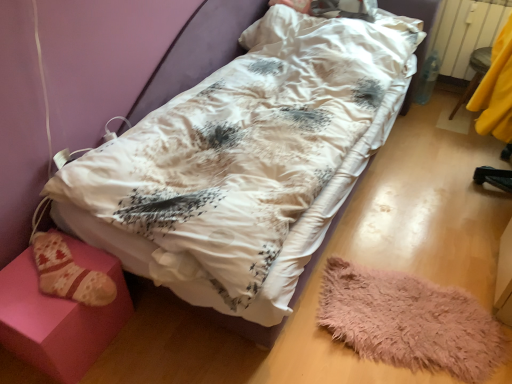
The height and width of the screenshot is (384, 512). Identify the location of white satin hospital bed at center. (250, 159).

The height and width of the screenshot is (384, 512). What do you see at coordinates (250, 159) in the screenshot?
I see `white satin hospital bed at center` at bounding box center [250, 159].

Image resolution: width=512 pixels, height=384 pixels. What do you see at coordinates (475, 74) in the screenshot?
I see `yellow fabric at right, placed as the 2th furniture when sorted from left to right` at bounding box center [475, 74].

The height and width of the screenshot is (384, 512). I want to click on white satin hospital bed at center, so click(x=250, y=159).

Can you confirm if white plastic radiator at upper right is taller than yellow fabric at right, the 2th furniture when ordered from bottom to top?

Yes.

From a real-world perspective, who is located lower, white plastic radiator at upper right or yellow fabric at right, placed as the 2th furniture when sorted from left to right?

In real-world perspective, yellow fabric at right, placed as the 2th furniture when sorted from left to right, is lower.

Is white plastic radiator at upper right not inside yellow fabric at right, arranged as the second furniture when viewed from the front?

Yes.

Which is more to the right, white plastic radiator at upper right or yellow fabric at right, which is the 1th furniture in right-to-left order?

Positioned to the right is yellow fabric at right, which is the 1th furniture in right-to-left order.

How different are the orientations of yellow fabric at right, arranged as the second furniture when viewed from the front, and pink fabric stool at lower left, which is the 2th furniture in back-to-front order, in degrees?

88.6 degrees separate the facing orientations of yellow fabric at right, arranged as the second furniture when viewed from the front, and pink fabric stool at lower left, which is the 2th furniture in back-to-front order.

Would you consider yellow fabric at right, which is the 1th furniture in right-to-left order, to be distant from pink fabric stool at lower left, which is the 2th furniture in back-to-front order?

Yes, yellow fabric at right, which is the 1th furniture in right-to-left order, and pink fabric stool at lower left, which is the 2th furniture in back-to-front order, are quite far apart.

The height and width of the screenshot is (384, 512). In order to click on furniture in front of the yellow fabric at right, arranged as the second furniture when viewed from the front in this screenshot , I will do `click(59, 315)`.

Can you confirm if yellow fabric at right, the 2th furniture when ordered from bottom to top, is thinner than pink fabric stool at lower left, which appears as the first furniture when viewed from the left?

In fact, yellow fabric at right, the 2th furniture when ordered from bottom to top, might be wider than pink fabric stool at lower left, which appears as the first furniture when viewed from the left.

From the image's perspective, is white plastic radiator at upper right on fluffy pink mat at lower right?

Yes, from the image's perspective, white plastic radiator at upper right is above fluffy pink mat at lower right.

Between white plastic radiator at upper right and fluffy pink mat at lower right, which one appears on the left side from the viewer's perspective?

Positioned to the left is fluffy pink mat at lower right.

Which object is further away from the camera taking this photo, white plastic radiator at upper right or fluffy pink mat at lower right?

white plastic radiator at upper right is further away from the camera.

Who is taller, white plastic radiator at upper right or fluffy pink mat at lower right?

With more height is white plastic radiator at upper right.

How many degrees apart are the facing directions of white satin hospital bed at center and fluffy pink mat at lower right?

There is a 6.9-degree angle between the facing directions of white satin hospital bed at center and fluffy pink mat at lower right.

Is white satin hospital bed at center touching fluffy pink mat at lower right?

No, white satin hospital bed at center is not making contact with fluffy pink mat at lower right.

In the scene shown: Is white satin hospital bed at center aimed at fluffy pink mat at lower right?

No, white satin hospital bed at center is not oriented towards fluffy pink mat at lower right.

From a real-world perspective, which object rests below the other?

In real-world perspective, pink fabric stool at lower left, which appears as the first furniture when viewed from the left, is lower.

From their relative heights in the image, would you say pink fabric stool at lower left, which appears as the 1th furniture when viewed from the front, is taller or shorter than white plastic radiator at upper right?

Clearly, pink fabric stool at lower left, which appears as the 1th furniture when viewed from the front, is shorter compared to white plastic radiator at upper right.

At what (x,y) coordinates should I click in order to perform the action: click on furniture that is the 2nd one when counting downward from the white plastic radiator at upper right (from the image's perspective). Please return your answer as a coordinate pair (x, y). This screenshot has height=384, width=512. Looking at the image, I should click on (59, 315).

Is pink fabric stool at lower left, which is the 2th furniture in back-to-front order, directly adjacent to white plastic radiator at upper right?

No, pink fabric stool at lower left, which is the 2th furniture in back-to-front order, is not in contact with white plastic radiator at upper right.

Is point (416, 338) positioned behind point (477, 74)?

That is False.

From a real-world perspective, is fluffy pink mat at lower right located higher than yellow fabric at right, which is the 1th furniture in right-to-left order?

No, from a real-world perspective, fluffy pink mat at lower right is not above yellow fabric at right, which is the 1th furniture in right-to-left order.

Could you tell me if fluffy pink mat at lower right is turned towards yellow fabric at right, which is the 1th furniture in right-to-left order?

No.

Between yellow fabric at right, placed as the 2th furniture when sorted from left to right, and white satin hospital bed at center, which one has smaller width?

With smaller width is yellow fabric at right, placed as the 2th furniture when sorted from left to right.

Is yellow fabric at right, the 2th furniture when ordered from bottom to top, in front of or behind white satin hospital bed at center in the image?

yellow fabric at right, the 2th furniture when ordered from bottom to top, is behind white satin hospital bed at center.

From the picture: Can you confirm if yellow fabric at right, arranged as the second furniture when viewed from the front, is shorter than white satin hospital bed at center?

In fact, yellow fabric at right, arranged as the second furniture when viewed from the front, may be taller than white satin hospital bed at center.

Locate an element on the screen. The height and width of the screenshot is (384, 512). radiator on the left of the yellow fabric at right, the 2th furniture when ordered from bottom to top is located at coordinates (465, 33).

The width and height of the screenshot is (512, 384). Find the location of `furniture behind the pink fabric stool at lower left, which is the 2th furniture in back-to-front order`. furniture behind the pink fabric stool at lower left, which is the 2th furniture in back-to-front order is located at coordinates (475, 74).

Which object lies nearer to the anchor point fluffy pink mat at lower right, white satin hospital bed at center or yellow fabric at right, arranged as the second furniture when viewed from the front?

The object closer to fluffy pink mat at lower right is white satin hospital bed at center.

Estimate the real-world distances between objects in this image. Which object is closer to fluffy pink mat at lower right, pink fabric stool at lower left, acting as the 2th furniture starting from the right, or yellow fabric at right, which ranks as the first furniture in top-to-bottom order?

Based on the image, pink fabric stool at lower left, acting as the 2th furniture starting from the right, appears to be nearer to fluffy pink mat at lower right.

From the image, which object appears to be nearer to yellow fabric at right, which ranks as the first furniture in top-to-bottom order, white satin hospital bed at center or white plastic radiator at upper right?

The object closer to yellow fabric at right, which ranks as the first furniture in top-to-bottom order, is white plastic radiator at upper right.

Looking at this image, when comparing their distances from pink fabric stool at lower left, which is the 2th furniture in back-to-front order, does fluffy pink mat at lower right or yellow fabric at right, arranged as the second furniture when viewed from the front, seem further?

yellow fabric at right, arranged as the second furniture when viewed from the front, lies further to pink fabric stool at lower left, which is the 2th furniture in back-to-front order, than the other object.

Looking at the image, which one is located closer to yellow fabric at right, which ranks as the first furniture in top-to-bottom order, white satin hospital bed at center or pink fabric stool at lower left, the first furniture ordered from the bottom?

white satin hospital bed at center is closer to yellow fabric at right, which ranks as the first furniture in top-to-bottom order.

When comparing their distances from fluffy pink mat at lower right, does pink fabric stool at lower left, the second furniture viewed from the top, or white satin hospital bed at center seem closer?

white satin hospital bed at center.

Estimate the real-world distances between objects in this image. Which object is further from white satin hospital bed at center, yellow fabric at right, placed as the 2th furniture when sorted from left to right, or fluffy pink mat at lower right?

yellow fabric at right, placed as the 2th furniture when sorted from left to right.

Looking at the image, which one is located further to fluffy pink mat at lower right, pink fabric stool at lower left, the second furniture viewed from the top, or white plastic radiator at upper right?

Among the two, white plastic radiator at upper right is located further to fluffy pink mat at lower right.

Identify the location of mat between pink fabric stool at lower left, the second furniture viewed from the top, and yellow fabric at right, the 2th furniture when ordered from bottom to top, in the horizontal direction. This screenshot has width=512, height=384. (409, 321).

You are a GUI agent. You are given a task and a screenshot of the screen. Output one action in this format:
    pyautogui.click(x=<x>, y=<y>)
    Task: Click on the radiator located between pink fabric stool at lower left, which appears as the first furniture when viewed from the left, and yellow fabric at right, placed as the 2th furniture when sorted from left to right, in the left-right direction
    The height and width of the screenshot is (384, 512).
    Given the screenshot: What is the action you would take?
    point(465,33)

Identify the location of mat between white satin hospital bed at center and yellow fabric at right, which ranks as the 1th furniture in back-to-front order, from front to back. Image resolution: width=512 pixels, height=384 pixels. point(409,321).

The width and height of the screenshot is (512, 384). In order to click on mat between white satin hospital bed at center and white plastic radiator at upper right from front to back in this screenshot , I will do `click(409, 321)`.